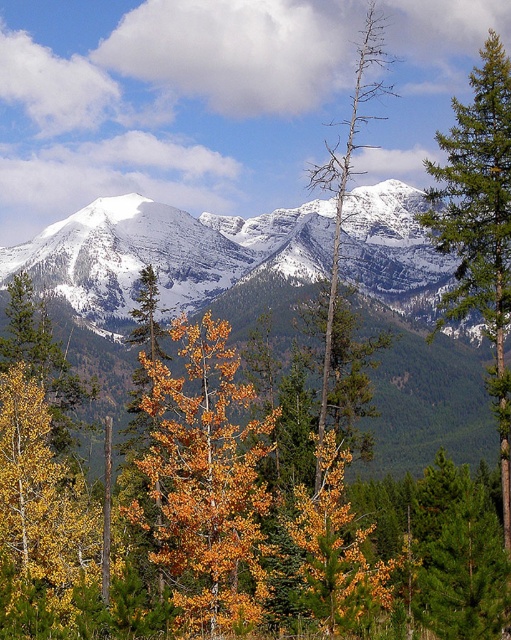
Question: Is snowy granite mountains at center further to camera compared to green textured pine tree at right?

Choices:
 (A) yes
 (B) no

Answer: (A)

Question: Among these objects, which one is farthest from the camera?

Choices:
 (A) bare wood tree at center
 (B) yellow leafy tree at center

Answer: (A)

Question: Estimate the real-world distances between objects in this image. Which object is farther from the green textured pine tree at right?

Choices:
 (A) snowy granite mountains at center
 (B) yellow leafy tree at center
 (C) bare wood tree at center
 (D) orange leafy tree at center

Answer: (A)

Question: Which point appears farthest from the camera in this image?

Choices:
 (A) (196, 616)
 (B) (362, 97)
 (C) (467, 205)
 (D) (56, 632)

Answer: (B)

Question: Can you confirm if orange leafy tree at center is positioned above bare wood tree at center?

Choices:
 (A) no
 (B) yes

Answer: (A)

Question: Where is yellow leafy tree at center located in relation to snowy granite mountains at center in the image?

Choices:
 (A) above
 (B) below

Answer: (B)